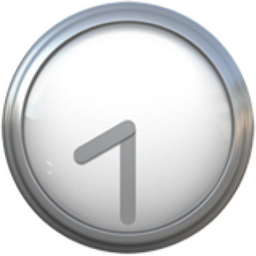
Where is `clock`? clock is located at coordinates (197, 151).